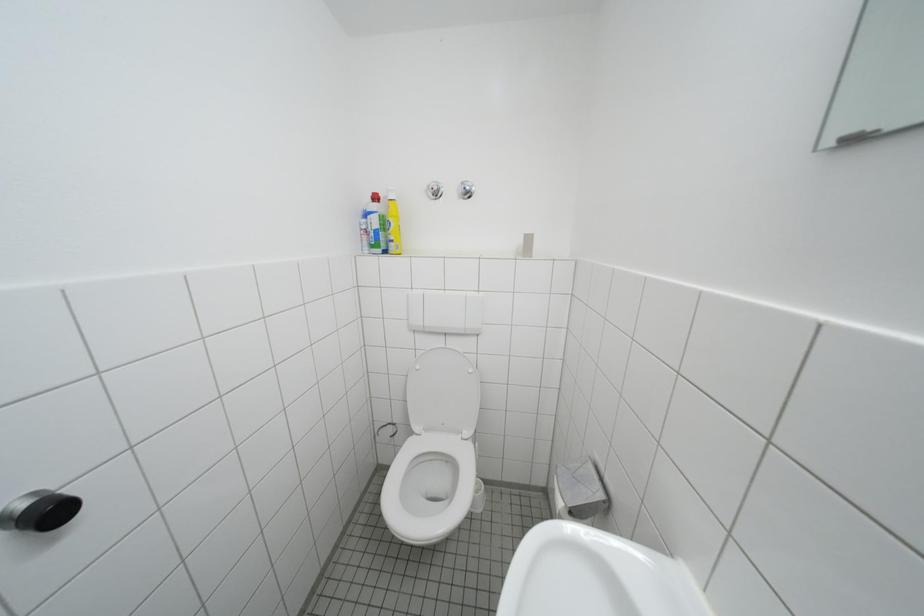
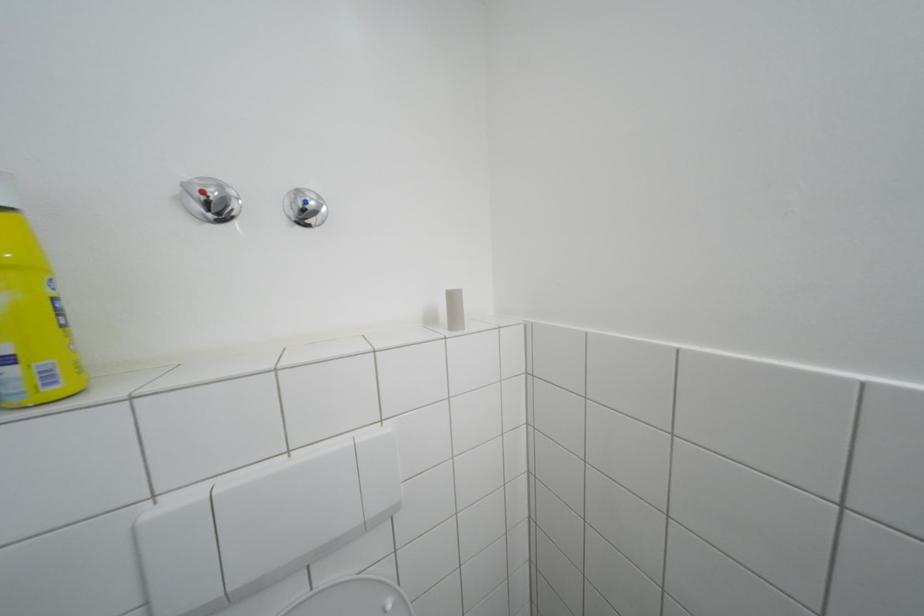
Question: The camera is either moving clockwise (left) or counter-clockwise (right) around the object. The first image is from the beginning of the video and the second image is from the end. Is the camera moving left or right when shooting the video?

Choices:
 (A) Left
 (B) Right

Answer: (A)